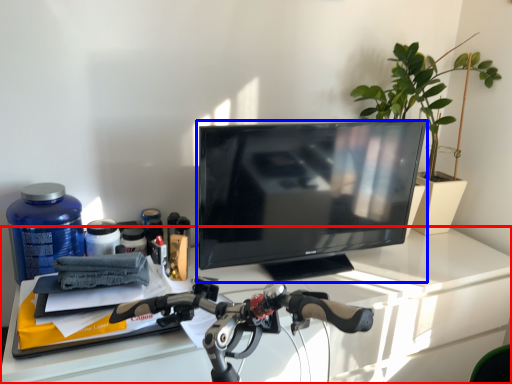
Question: Which of the following is the closest to the observer, desk (highlighted by a red box) or television (highlighted by a blue box)?

Choices:
 (A) desk
 (B) television

Answer: (A)